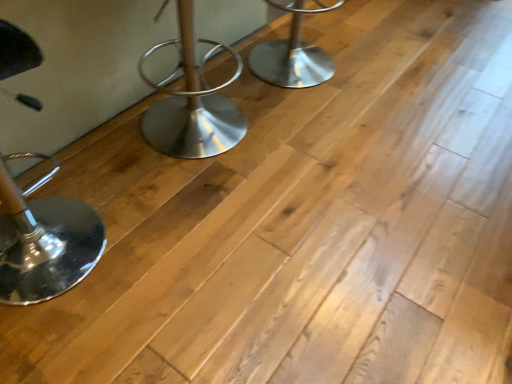
Find the location of a particular element. This screenshot has height=384, width=512. empty space that is to the right of polished chrome stool at left, marked as the first furniture in a bottom-to-top arrangement is located at coordinates (180, 263).